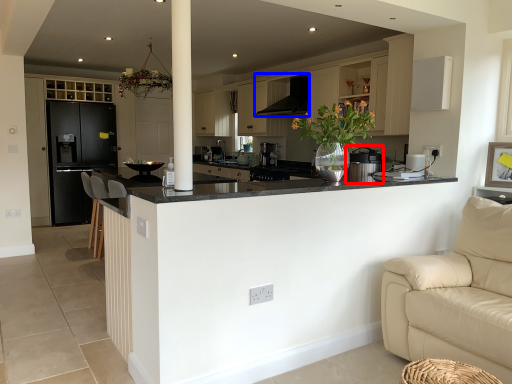
Question: Which object is closer to the camera taking this photo, appliance (highlighted by a red box) or exhaust hood (highlighted by a blue box)?

Choices:
 (A) appliance
 (B) exhaust hood

Answer: (A)